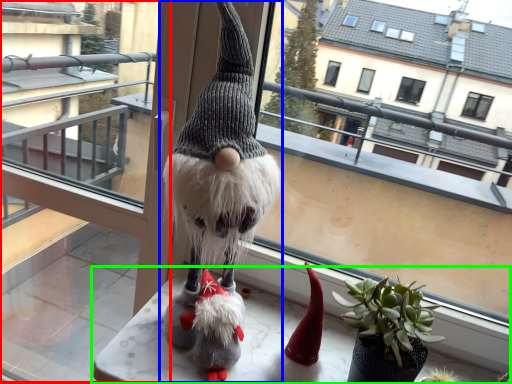
Question: Considering the real-world distances, which object is closest to glass door (highlighted by a red box)? figurine (highlighted by a blue box) or table (highlighted by a green box).

Choices:
 (A) figurine
 (B) table

Answer: (B)